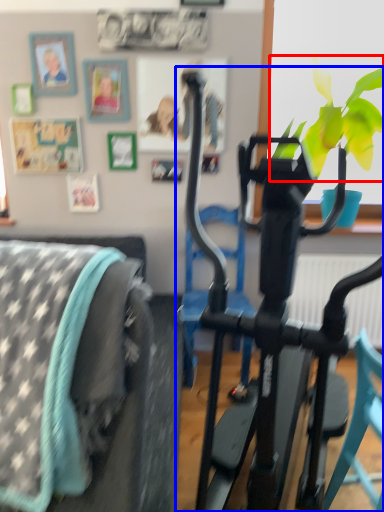
Question: Which point is further to the camera, flower (highlighted by a red box) or stationary bicycle (highlighted by a blue box)?

Choices:
 (A) flower
 (B) stationary bicycle

Answer: (A)